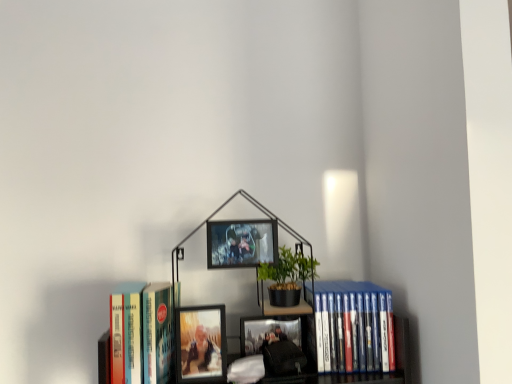
Question: Considering the positions of metallic silver picture frame at center, which is the 1th picture frame from top to bottom, and blue plastic dvds at right, which is the second book from left to right, in the image, is metallic silver picture frame at center, which is the 1th picture frame from top to bottom, bigger or smaller than blue plastic dvds at right, which is the second book from left to right,?

Choices:
 (A) big
 (B) small

Answer: (B)

Question: Is metallic silver picture frame at center, marked as the 2th picture frame in a bottom-to-top arrangement, taller or shorter than blue plastic dvds at right, which is the second book from left to right?

Choices:
 (A) short
 (B) tall

Answer: (A)

Question: Which of these objects is positioned closest to the blue plastic dvds at right, which is the second book from left to right?

Choices:
 (A) matte glass photo frame at center, the 2th picture frame in the top-to-bottom sequence
 (B) hardcover book at left, marked as the 1th book in a left-to-right arrangement
 (C) metallic silver picture frame at center, marked as the 2th picture frame in a bottom-to-top arrangement

Answer: (C)

Question: Which object is the closest to the blue plastic dvds at right, which is the second book from left to right?

Choices:
 (A) hardcover book at left, placed as the second book when sorted from right to left
 (B) metallic silver picture frame at center, marked as the 2th picture frame in a bottom-to-top arrangement
 (C) matte glass photo frame at center, which ranks as the first picture frame in bottom-to-top order

Answer: (B)